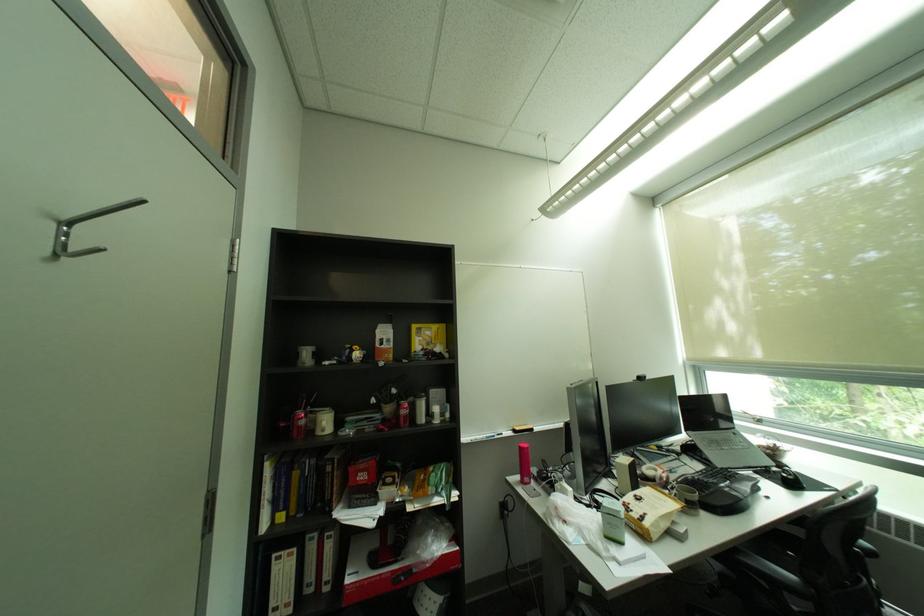
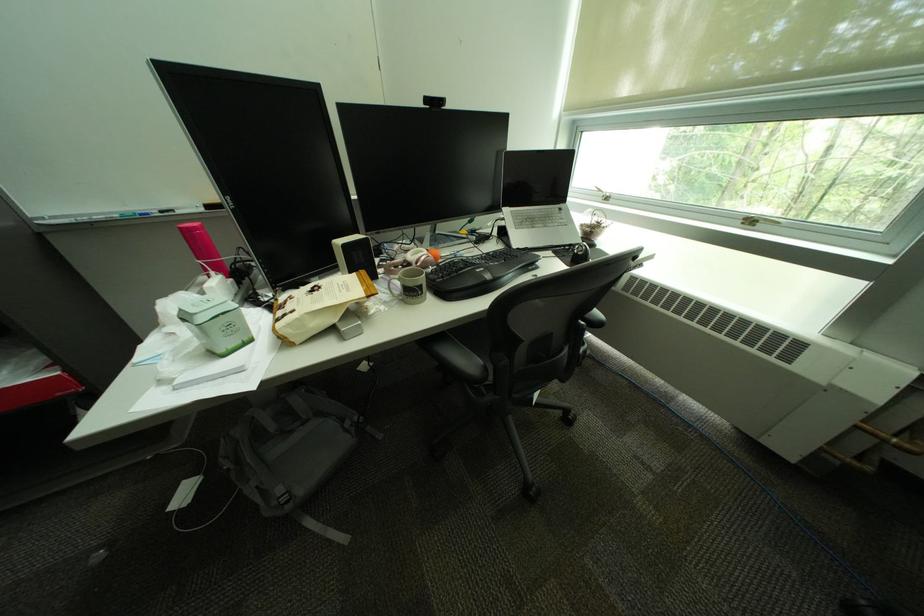
The point at (777, 468) is marked in the first image. Where is the corresponding point in the second image?

(580, 246)